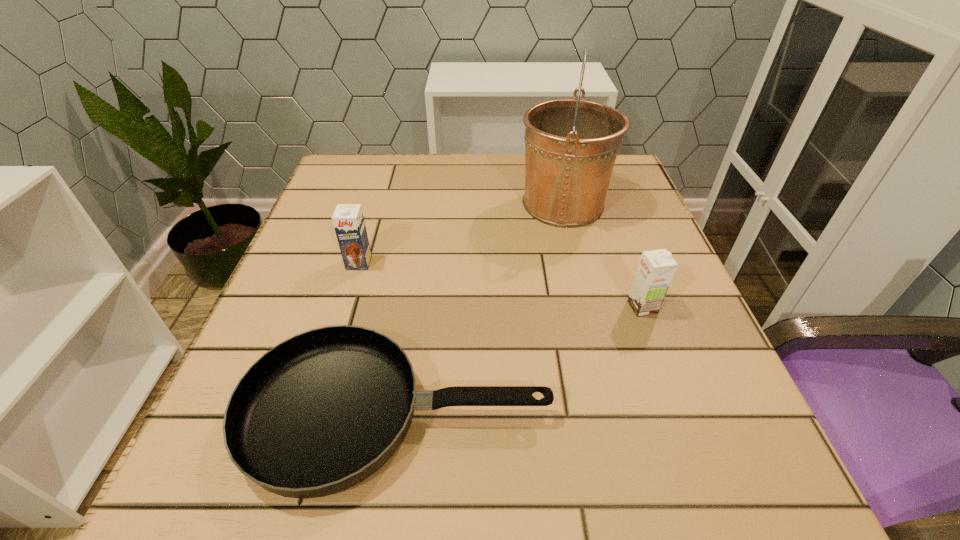
Identify the location of bucket. This screenshot has width=960, height=540. (571, 145).

This screenshot has width=960, height=540. What are the coordinates of `the tallest object` in the screenshot? It's located at (571, 145).

Identify the location of the second farthest object. The width and height of the screenshot is (960, 540). (348, 220).

Where is `the farther chocolate milk`? the farther chocolate milk is located at coordinates (348, 220).

This screenshot has width=960, height=540. What are the coordinates of `the right chocolate milk` in the screenshot? It's located at (656, 268).

This screenshot has width=960, height=540. I want to click on the second nearest object, so click(656, 268).

This screenshot has width=960, height=540. What are the coordinates of `the shortest object` in the screenshot? It's located at (319, 413).

You are a GUI agent. You are given a task and a screenshot of the screen. Output one action in this format:
    pyautogui.click(x=<x>, y=<y>)
    Task: Click on the nearest object
    This screenshot has width=960, height=540.
    Given the screenshot: What is the action you would take?
    pyautogui.click(x=319, y=413)

Locate an element on the screen. free location located 0.350m on the left of the farthest object is located at coordinates (365, 204).

At what (x,y) coordinates should I click in order to perform the action: click on vacant space located on the front label of the second farthest object. Please return your answer as a coordinate pair (x, y). Looking at the image, I should click on (297, 468).